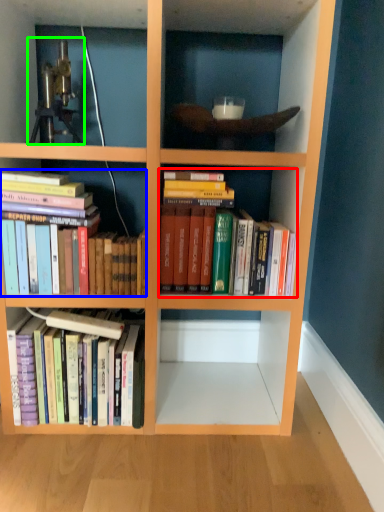
Question: Estimate the real-world distances between objects in this image. Which object is closer to book (highlighted by a red box), book (highlighted by a blue box) or telescope (highlighted by a green box)?

Choices:
 (A) book
 (B) telescope

Answer: (A)